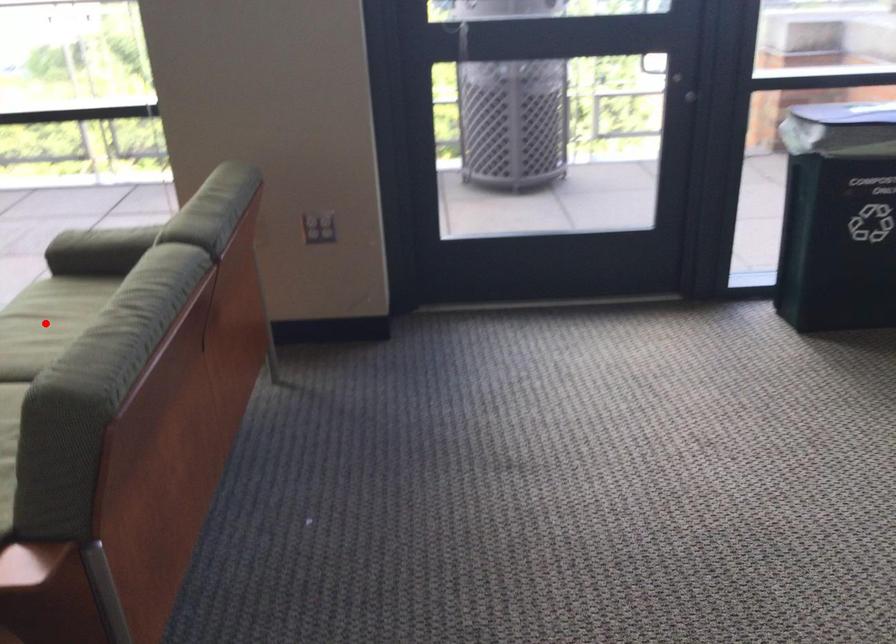
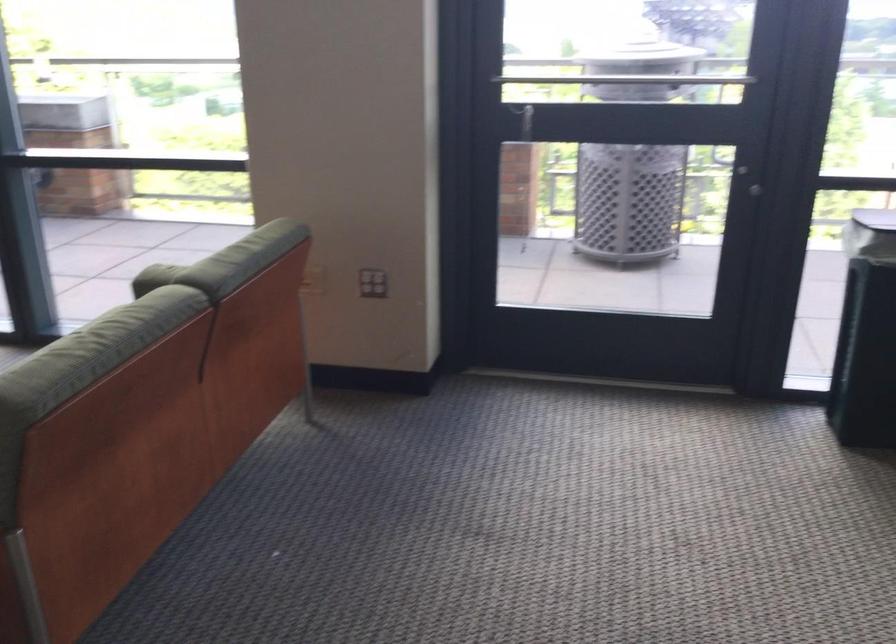
Question: I am providing you with two images of the same scene from different viewpoints. A red point is marked on the first image. Can you still see the location of the red point in image 2?

Choices:
 (A) Yes
 (B) No

Answer: (B)